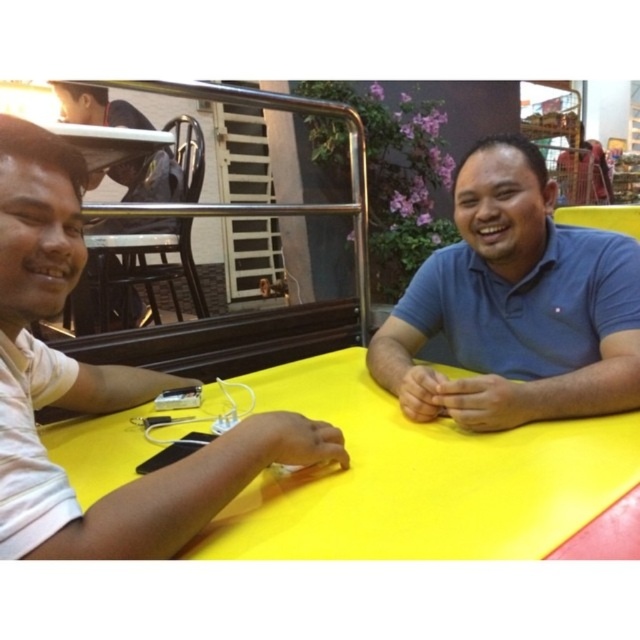
Who is more distant from viewer, (x=272, y=385) or (x=436, y=316)?

The point (x=436, y=316) is behind.

Does point (408, 513) come farther from viewer compared to point (467, 326)?

That is False.

Find the location of a particular element. This screenshot has height=640, width=640. yellow matte table at center is located at coordinates (419, 480).

Is point (314, 403) closer to viewer compared to point (148, 173)?

Yes, it is.

Where is `yellow matte table at center`? The height and width of the screenshot is (640, 640). yellow matte table at center is located at coordinates (419, 480).

Is yellow matte table at center wider than white matte shirt at left?

Yes, yellow matte table at center is wider than white matte shirt at left.

Does yellow matte table at center have a greater height compared to white matte shirt at left?

Incorrect, yellow matte table at center's height is not larger of white matte shirt at left's.

Is point (211, 552) farther from camera compared to point (29, 481)?

Yes, point (211, 552) is farther from viewer.

Find the location of a particular element. This screenshot has width=640, height=640. yellow matte table at center is located at coordinates point(419,480).